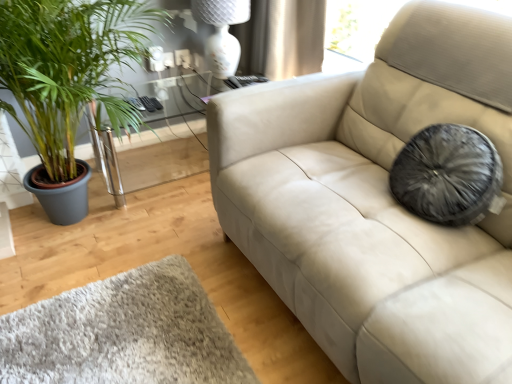
Question: From a real-world perspective, relative to clear glass table at left, is green leafy plant at left vertically above or below?

Choices:
 (A) below
 (B) above

Answer: (B)

Question: Is point (73, 64) closer or farther from the camera than point (119, 147)?

Choices:
 (A) farther
 (B) closer

Answer: (B)

Question: Considering the real-world distances, which object is farthest from the clear glass table at left?

Choices:
 (A) green leafy plant at left
 (B) white glossy lamp at upper center

Answer: (A)

Question: Which object is positioned farthest from the green leafy plant at left?

Choices:
 (A) clear glass table at left
 (B) white glossy lamp at upper center

Answer: (B)